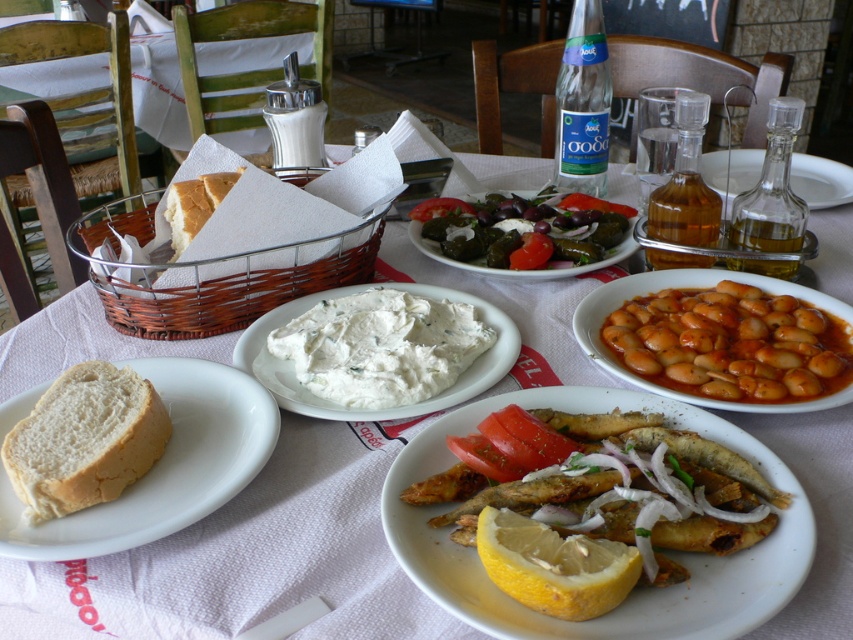
Looking at this image, which of these two, brown matte beans at center right or white soft bread at center, stands taller?

brown matte beans at center right

Does brown matte beans at center right have a lesser width compared to white soft bread at center?

No, brown matte beans at center right is not thinner than white soft bread at center.

Is point (724, 356) positioned before point (4, 444)?

No, (724, 356) is behind (4, 444).

This screenshot has height=640, width=853. In order to click on brown matte beans at center right in this screenshot , I will do `click(730, 344)`.

Does white ceramic plate at center appear on the left side of brown matte beans at center right?

Indeed, white ceramic plate at center is positioned on the left side of brown matte beans at center right.

Does white ceramic plate at center have a greater width compared to brown matte beans at center right?

Yes, white ceramic plate at center is wider than brown matte beans at center right.

Does point (779, 560) come closer to viewer compared to point (683, 314)?

Yes, it is in front of point (683, 314).

At what (x,y) coordinates should I click in order to perform the action: click on white ceramic plate at center. Please return your answer as a coordinate pair (x, y). Looking at the image, I should click on (636, 589).

Between white creamy dip at center and transparent glass bottle at center, which one has less height?

white creamy dip at center is shorter.

Does white creamy dip at center lie behind transparent glass bottle at center?

No, white creamy dip at center is closer to the viewer.

Locate an element on the screen. Image resolution: width=853 pixels, height=640 pixels. white creamy dip at center is located at coordinates (381, 346).

The width and height of the screenshot is (853, 640). In order to click on white creamy dip at center in this screenshot , I will do `click(381, 346)`.